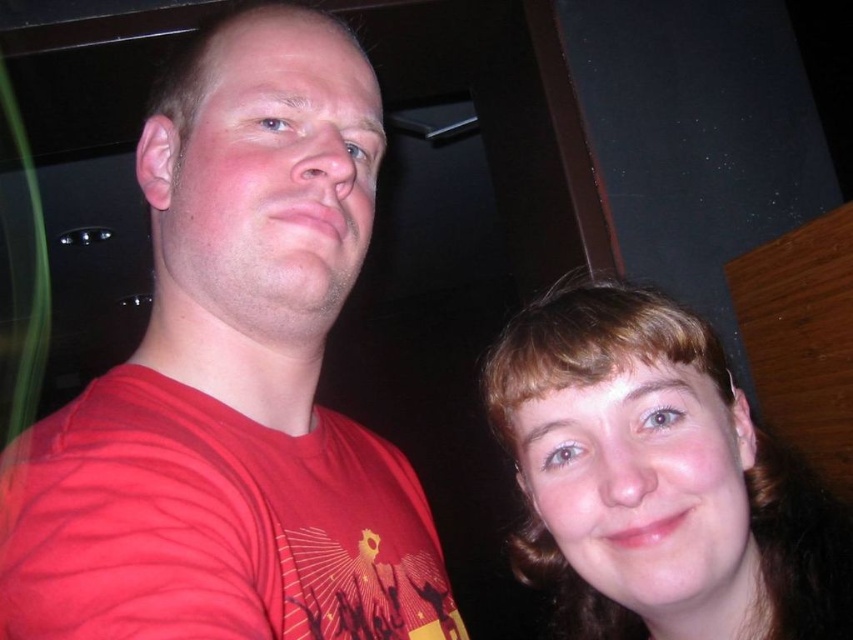
Is matte red t-shirt at left closer to camera compared to brown hair at upper right?

Yes, matte red t-shirt at left is closer to the viewer.

Who is taller, matte red t-shirt at left or brown hair at upper right?

With more height is matte red t-shirt at left.

Is point (97, 596) in front of point (502, 337)?

That is True.

Locate an element on the screen. matte red t-shirt at left is located at coordinates click(x=231, y=384).